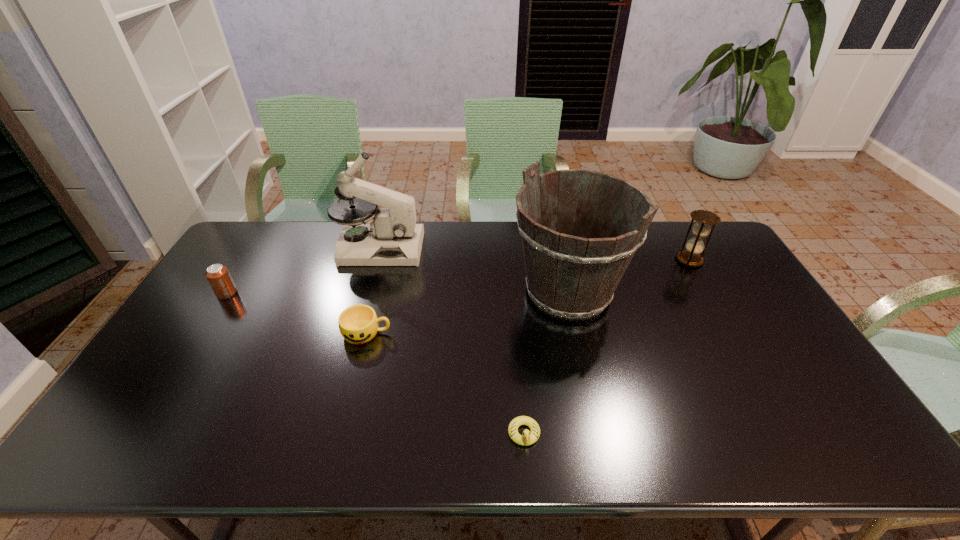
At what (x,y) coordinates should I click in order to perform the action: click on bucket. Please return your answer as a coordinate pair (x, y). Image resolution: width=960 pixels, height=540 pixels. Looking at the image, I should click on (573, 268).

Locate an element on the screen. microscope is located at coordinates (392, 238).

Locate an element on the screen. The height and width of the screenshot is (540, 960). the rightmost object is located at coordinates (690, 257).

The height and width of the screenshot is (540, 960). I want to click on hourglass, so click(690, 257).

Locate an element on the screen. the leftmost object is located at coordinates 218,275.

The image size is (960, 540). In order to click on the fourth tallest object in this screenshot , I will do `click(218, 275)`.

Find the location of a particular element. Image resolution: width=960 pixels, height=540 pixels. cup is located at coordinates (358, 324).

Find the location of `the shortest object`. the shortest object is located at coordinates (528, 438).

I want to click on duckling, so click(x=528, y=438).

Locate an element on the screen. This screenshot has height=540, width=960. free space located on the left of the bucket is located at coordinates (439, 292).